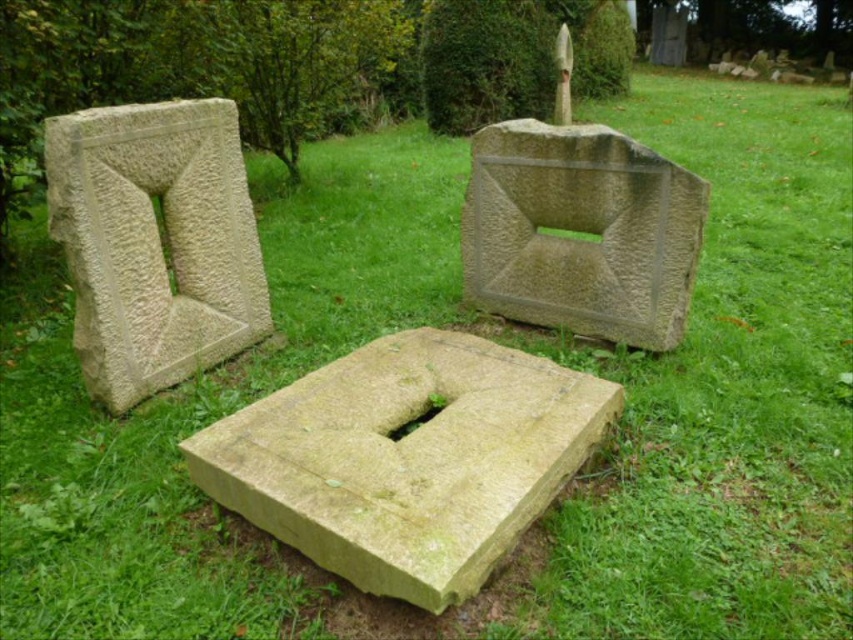
You are standing in front of the three stone blocks in the cemetery. You notice two points marked on the ground at coordinates point (227, 168) and point (660, 300). Which point is closer to you?

Point (227, 168) is further to the camera than point (660, 300). Therefore, point (660, 300) is closer to you.

You are standing at the point marked as point (407, 460) in the image. Which object is exactly at this location?

The yellowish stone block at center is exactly at point (407, 460).